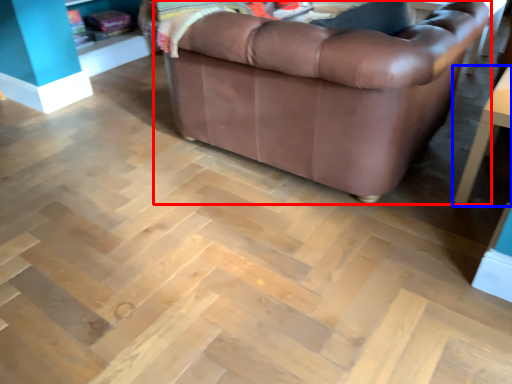
Question: Which of the following is the closest to the observer, studio couch (highlighted by a red box) or table (highlighted by a blue box)?

Choices:
 (A) studio couch
 (B) table

Answer: (A)